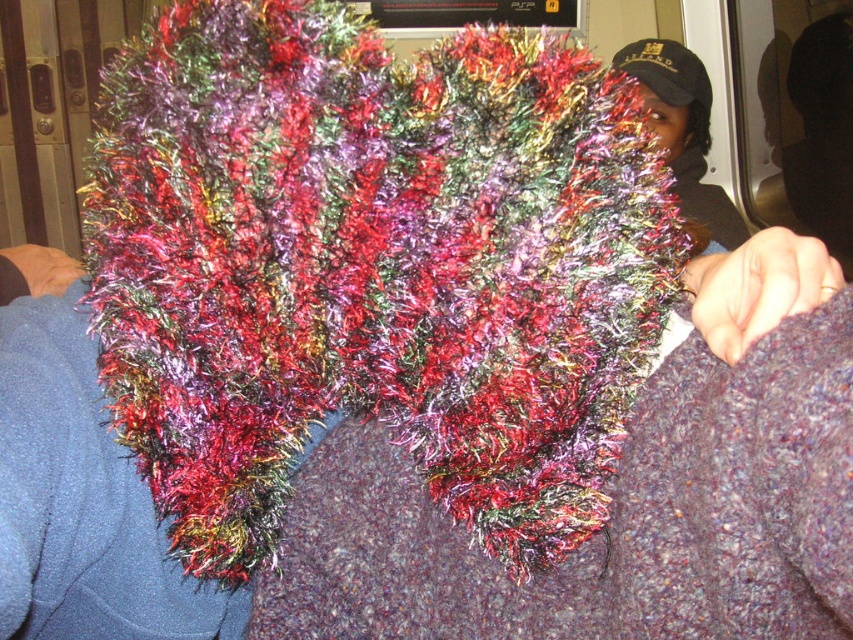
Question: Which of the following is the closest to the observer?

Choices:
 (A) (546, 548)
 (B) (656, 58)

Answer: (A)

Question: Is the position of shiny multicolored scarf at center more distant than that of black textured cap at upper right?

Choices:
 (A) no
 (B) yes

Answer: (A)

Question: Which point is closer to the camera?

Choices:
 (A) black textured cap at upper right
 (B) shiny multicolored scarf at center

Answer: (B)

Question: Can you confirm if shiny multicolored scarf at center is smaller than black textured cap at upper right?

Choices:
 (A) yes
 (B) no

Answer: (B)

Question: Does shiny multicolored scarf at center have a larger size compared to black textured cap at upper right?

Choices:
 (A) no
 (B) yes

Answer: (B)